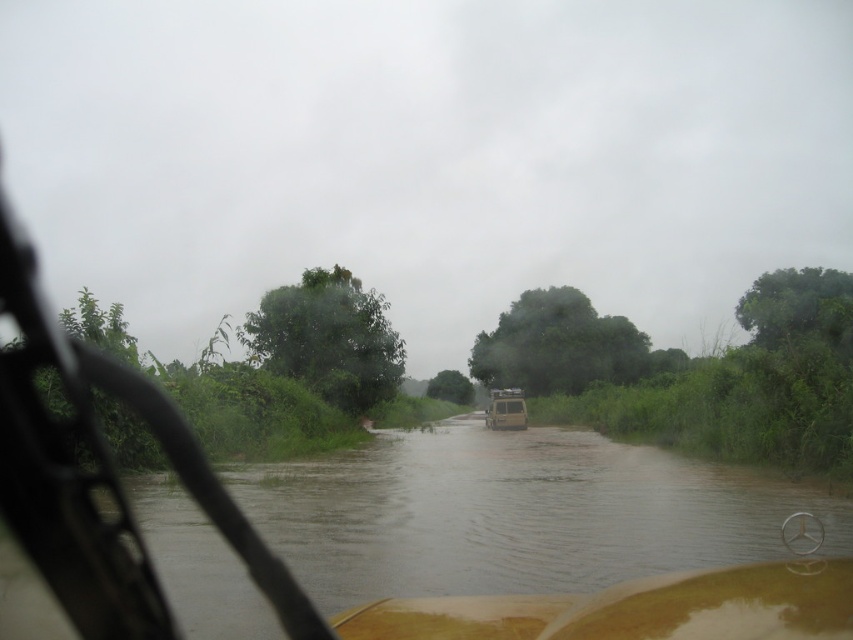
You are driving a metallic silver jeep at center and need to cross a brown muddy river at center. Based on the scene, can you safely drive through the river without getting stuck?

The brown muddy river at center might be wider than metallic silver jeep at center, so there is a possibility that the river is too wide for the jeep to safely cross without getting stuck. It would be advisable to seek an alternative route or assess the depth and current before proceeding.

You are driving a car and see the brown muddy river at center and the metallic silver jeep at center ahead on the flooded road. Which object takes up more space in the road ahead?

The brown muddy river at center is larger in size than the metallic silver jeep at center, so the brown muddy river at center takes up more space in the road ahead.